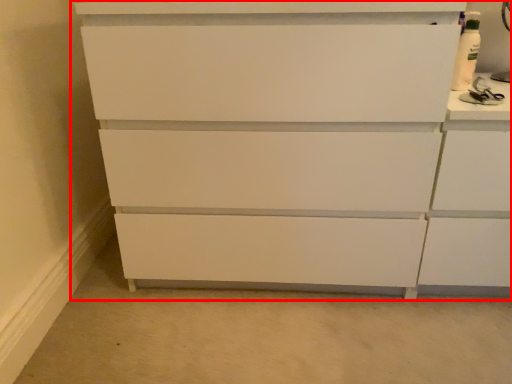
Question: From the image's perspective, what is the correct spatial relationship of chest of drawers (annotated by the red box) in relation to cabinetry?

Choices:
 (A) above
 (B) below

Answer: (A)